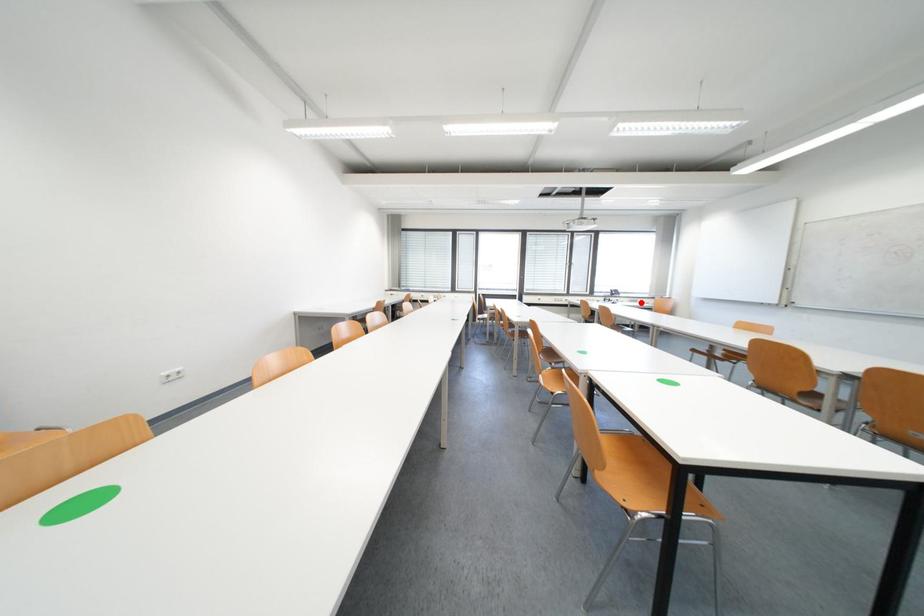
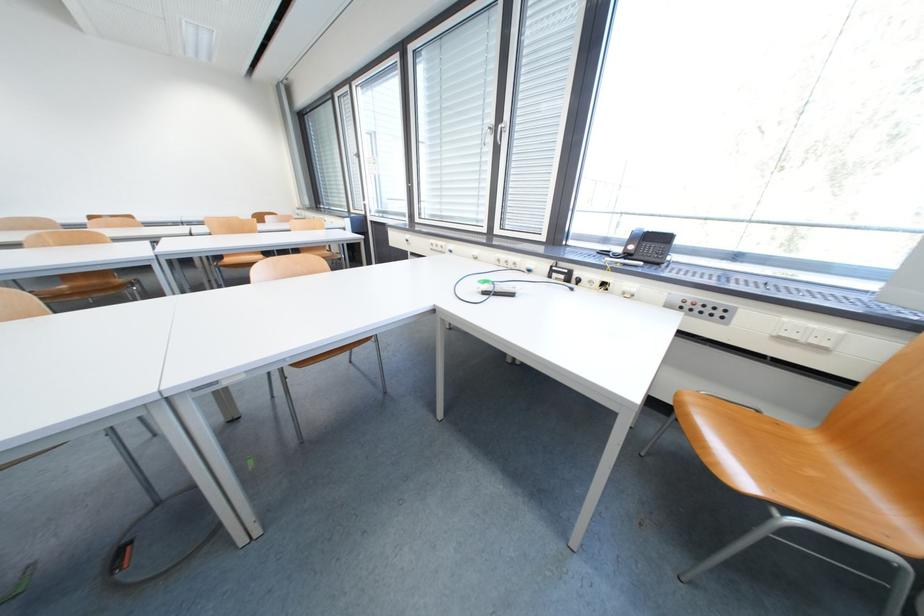
The point at the highlighted location is marked in the first image. Where is the corresponding point in the second image?

(725, 315)